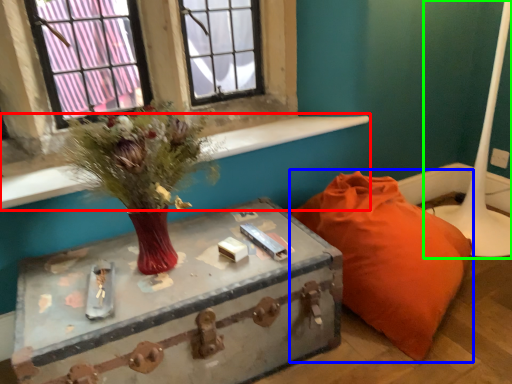
Question: Considering the real-world distances, which object is farthest from window sill (highlighted by a red box)? furniture (highlighted by a blue box) or table lamp (highlighted by a green box)?

Choices:
 (A) furniture
 (B) table lamp

Answer: (B)